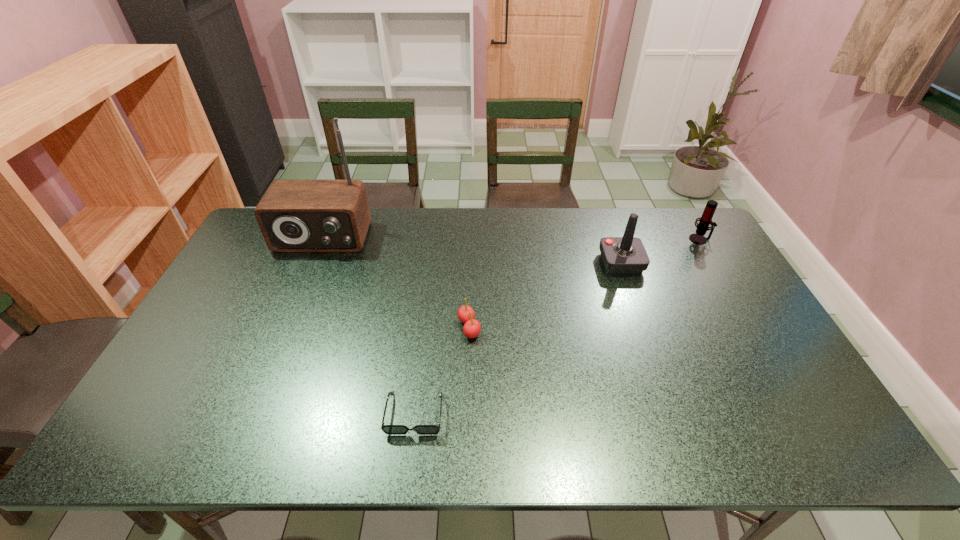
Identify the location of object at the far right corner. The width and height of the screenshot is (960, 540). (705, 220).

What are the coordinates of `vacant space at the far edge of the desktop` in the screenshot? It's located at (568, 226).

Where is `free region at the near edge of the desktop`? The image size is (960, 540). free region at the near edge of the desktop is located at coordinates (279, 436).

What are the coordinates of `vacant space at the left edge of the desktop` in the screenshot? It's located at (163, 388).

Where is `vacant space at the right edge`? The height and width of the screenshot is (540, 960). vacant space at the right edge is located at coordinates (774, 338).

In the image, there is a desktop. Where is `free space at the near left corner`? Image resolution: width=960 pixels, height=540 pixels. free space at the near left corner is located at coordinates coord(172,451).

Identify the location of free space at the far right corner of the desktop. Image resolution: width=960 pixels, height=540 pixels. (662, 214).

At what (x,y) coordinates should I click in order to perform the action: click on vacant space in between the cherry and the radio receiver. Please return your answer as a coordinate pair (x, y). Looking at the image, I should click on (396, 283).

Where is `blank region between the microphone and the second shortest object`? Image resolution: width=960 pixels, height=540 pixels. blank region between the microphone and the second shortest object is located at coordinates (585, 284).

Where is `vacant space that's between the nearest object and the rightmost object`? This screenshot has height=540, width=960. vacant space that's between the nearest object and the rightmost object is located at coordinates (557, 326).